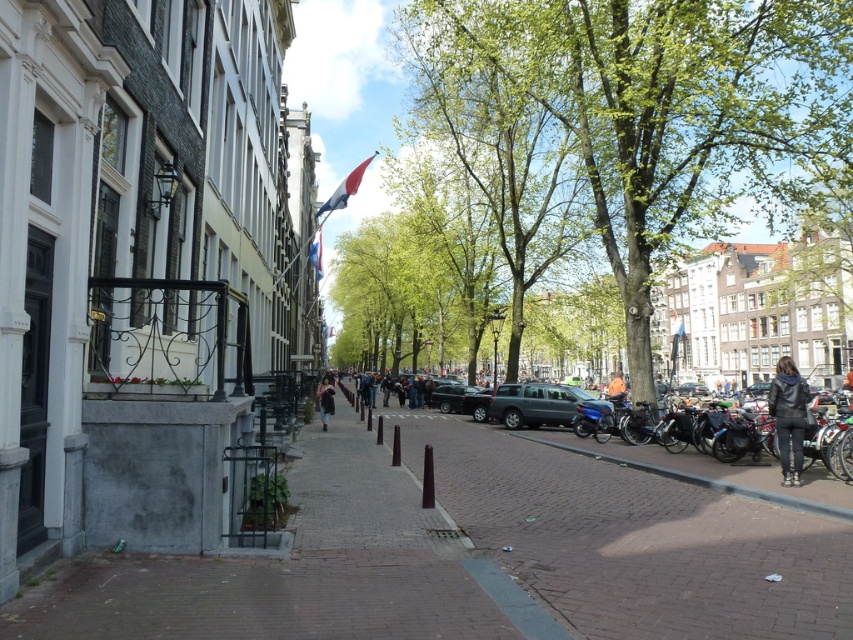
Question: Which point is closer to the camera?

Choices:
 (A) metallic silver car at center
 (B) green leafy tree at center
 (C) dark gray jacket at center

Answer: (B)

Question: Does metallic gray suv at center appear on the left side of shiny black car at center?

Choices:
 (A) yes
 (B) no

Answer: (B)

Question: Does brick pavement at center have a greater width compared to shiny black car at center?

Choices:
 (A) no
 (B) yes

Answer: (B)

Question: Considering the real-world distances, which object is farthest from the brick pavement at center?

Choices:
 (A) green leafy tree at center
 (B) orange fabric jacket at center
 (C) metallic gray suv at center
 (D) dark gray jacket at center

Answer: (A)

Question: Which object is farther from the camera taking this photo?

Choices:
 (A) orange fabric jacket at center
 (B) metallic silver car at center

Answer: (B)

Question: From the image, what is the correct spatial relationship of brick pavement at center in relation to dark gray jacket at center?

Choices:
 (A) left
 (B) right

Answer: (B)